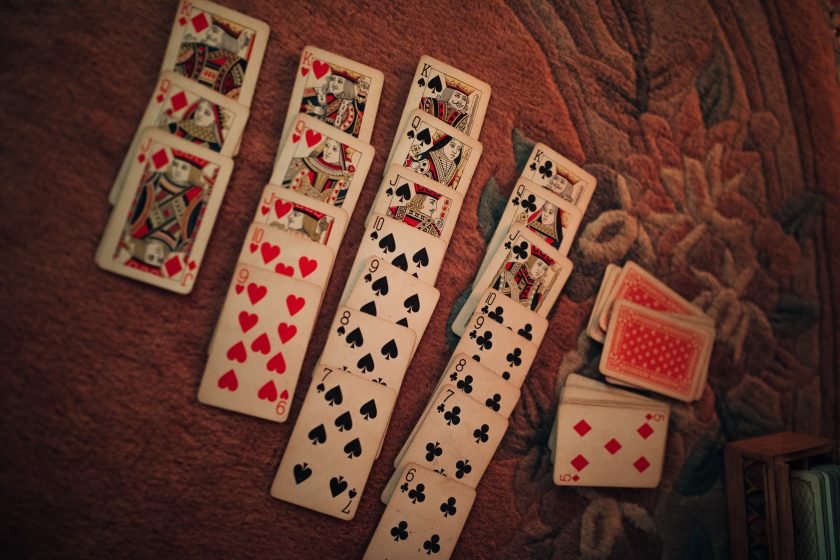
At what (x,y) coordinates should I click in order to perform the action: click on rug. Please return your answer as a coordinate pair (x, y). This screenshot has width=840, height=560. Looking at the image, I should click on (214, 446).